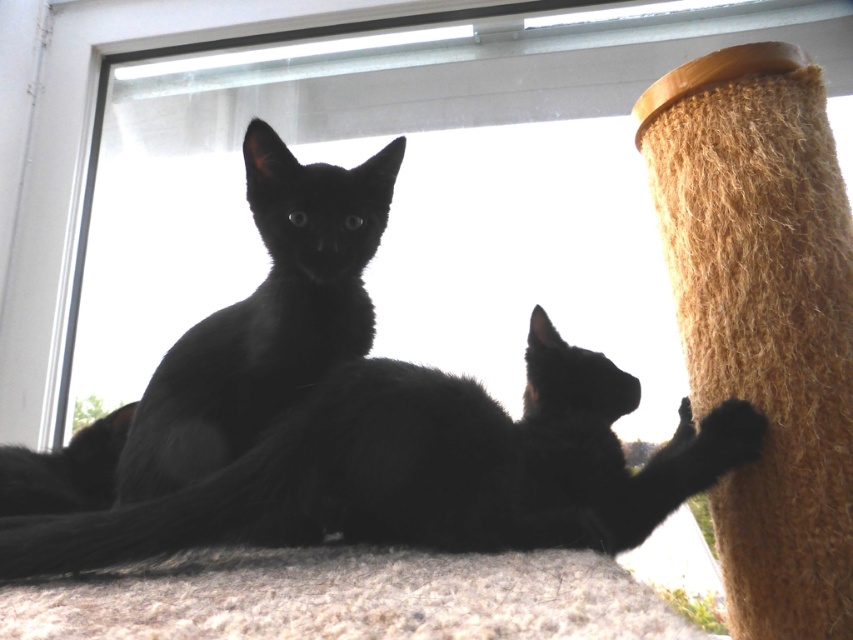
Based on the photo, you are a photographer setting up a shot of the two black fur cats. You need to ensure that the black fur cat at center and the black fur cat at upper left are both fully visible in the frame. Given that your camera has a fixed width, which cat should you position closer to the camera to maintain their visibility without cropping?

You should position the black fur cat at upper left closer to the camera because it is smaller in width than the black fur cat at center. This adjustment will help both cats fit within the frame without cropping.

You are a delivery person trying to enter the house through the transparent glass door at upper center. However, there is a black fur cat at center blocking your path. Can you walk around the cat to reach the door without disturbing it?

The transparent glass door at upper center is bigger than the black fur cat at center, so yes, you can walk around the cat to reach the door without disturbing it since the door is larger and provides enough space to maneuver around the cat.

You are a photographer adjusting your camera to focus on two specific points in the image. The first point is at coordinate point (314, 49) and the second is at point (372, 385). Since you want to ensure the closest point to the camera is in focus first, which coordinate should you prioritize focusing on?

Point (314, 49) is further to the camera than point (372, 385), so you should prioritize focusing on point (314, 49) first to ensure it is in focus.